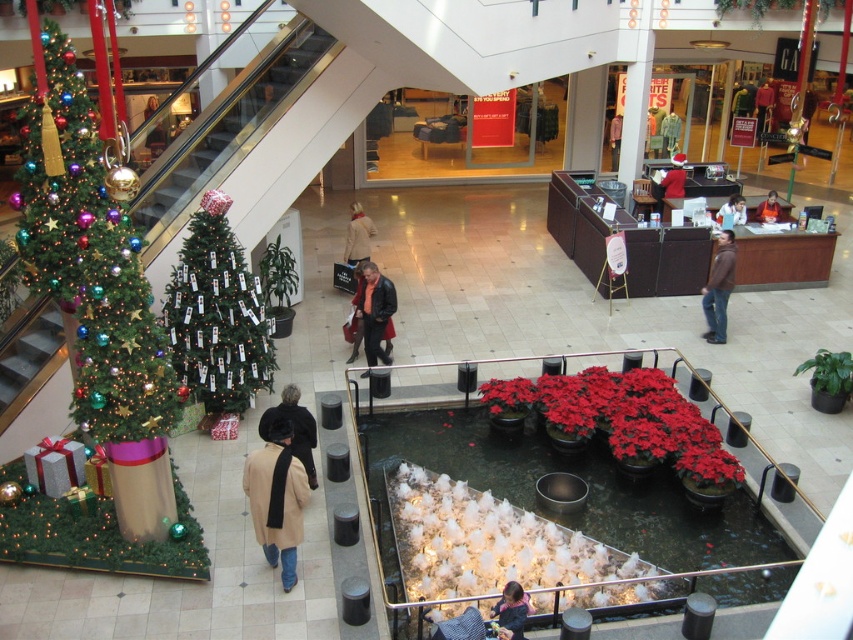
Question: Does shiny green christmas tree at left lie behind black fur hat at center?

Choices:
 (A) yes
 (B) no

Answer: (B)

Question: Among these objects, which one is nearest to the camera?

Choices:
 (A) light brown leather jacket at center
 (B) orange sweater at center
 (C) light beige sweater at center
 (D) metallic glass escalator at upper left

Answer: (D)

Question: In this image, where is dark blue sweater at lower center located relative to light beige sweater at center?

Choices:
 (A) below
 (B) above

Answer: (A)

Question: Considering the relative positions of dark blue sweater at lower center and light beige sweater at center in the image provided, where is dark blue sweater at lower center located with respect to light beige sweater at center?

Choices:
 (A) below
 (B) above

Answer: (A)

Question: Which of the following is the farthest from the observer?

Choices:
 (A) click(45, 264)
 (B) click(189, 349)
 (C) click(355, 232)

Answer: (C)

Question: Which object is closer to the camera taking this photo?

Choices:
 (A) leather jacket at center
 (B) light brown leather jacket at center
 (C) green textured christmas tree at left

Answer: (C)